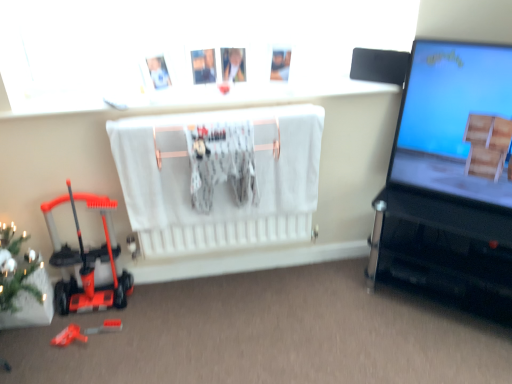
Question: Looking at the image, does matte blue screen at right seem bigger or smaller compared to rubberized orange toy at lower left, arranged as the 3th toy when viewed from the top?

Choices:
 (A) big
 (B) small

Answer: (A)

Question: Based on their positions, is matte blue screen at right located to the left or right of rubberized orange toy at lower left, arranged as the 3th toy when viewed from the top?

Choices:
 (A) right
 (B) left

Answer: (A)

Question: Which is farther from the orange plastic toy at lower left, the 1th toy when ordered from top to bottom?

Choices:
 (A) rubberized orange toy at lower left, which is counted as the 2th toy, starting from the top
 (B) green matte christmas tree at lower left
 (C) black glossy tv stand at right
 (D) rubberized orange toy at lower left, arranged as the 3th toy when viewed from the top
 (E) matte blue screen at right

Answer: (E)

Question: Which object is positioned farthest from the rubberized orange toy at lower left, which is counted as the second toy, starting from the bottom?

Choices:
 (A) orange plastic toy at lower left, positioned as the 3th toy in bottom-to-top order
 (B) green matte christmas tree at lower left
 (C) black glossy tv stand at right
 (D) matte blue screen at right
 (E) rubberized orange toy at lower left, the first toy from the bottom

Answer: (D)